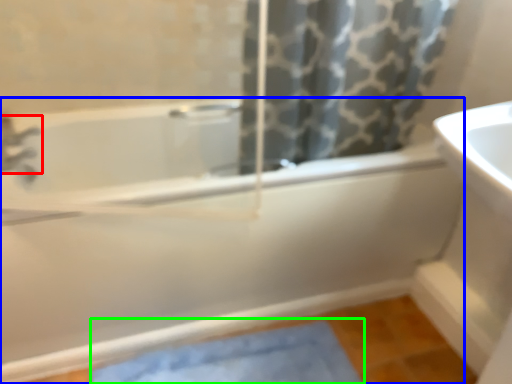
Question: Which object is positioned farthest from tap (highlighted by a red box)? Select from bathtub (highlighted by a blue box) and bath mat (highlighted by a green box).

Choices:
 (A) bathtub
 (B) bath mat

Answer: (B)